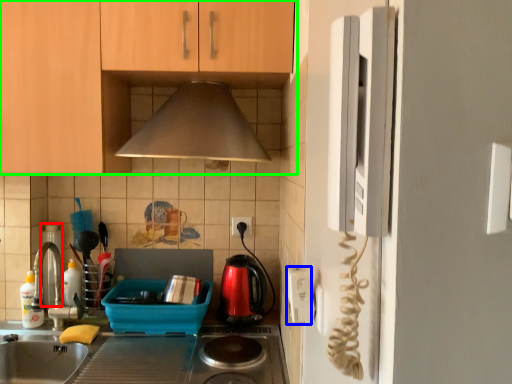
Question: Considering the real-world distances, which object is farthest from appliance (highlighted by a red box)? electric outlet (highlighted by a blue box) or cabinetry (highlighted by a green box)?

Choices:
 (A) electric outlet
 (B) cabinetry

Answer: (A)